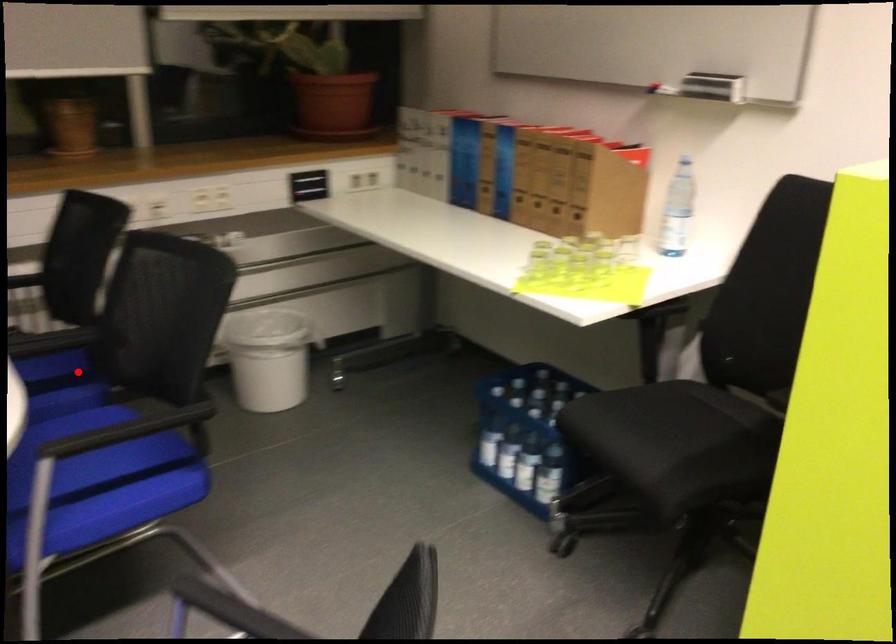
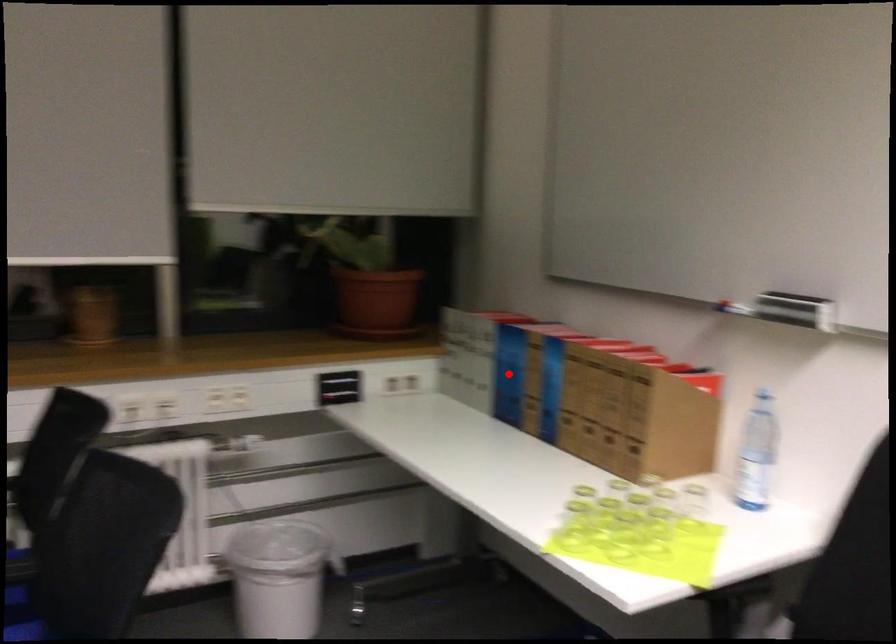
I am providing you with two images of the same scene from different viewpoints. A red point is marked on the first image and another point is marked on the second image. Do the highlighted points in image1 and image2 indicate the same real-world spot?

No